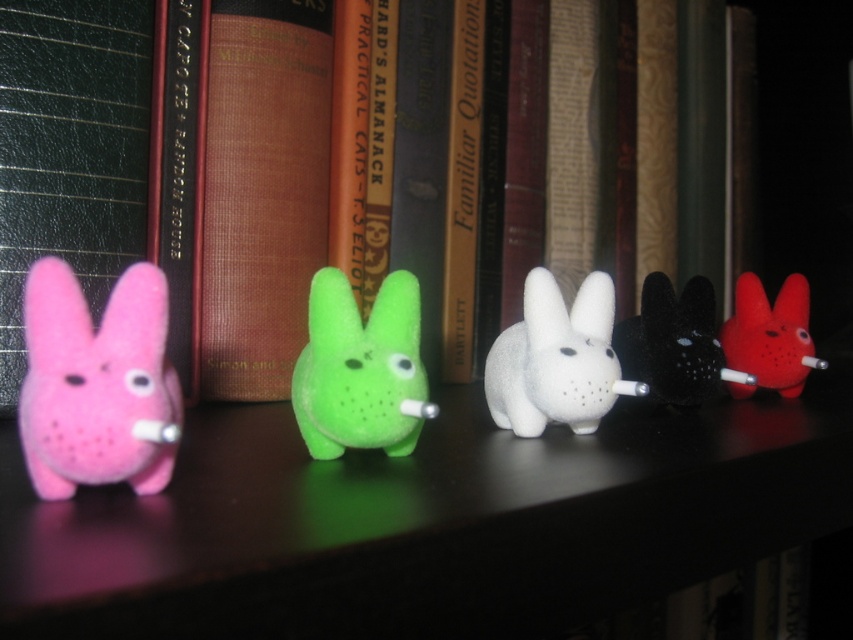
Question: Is matte pink plush at left to the right of green fuzzy bunny at center from the viewer's perspective?

Choices:
 (A) no
 (B) yes

Answer: (A)

Question: Is brown textured book at center to the left of black fuzzy bunny at center from the viewer's perspective?

Choices:
 (A) no
 (B) yes

Answer: (B)

Question: Estimate the real-world distances between objects in this image. Which object is farther from the black fuzzy bunny at center?

Choices:
 (A) matte pink plush at left
 (B) rubberized matte red rabbit at right
 (C) brown textured book at center

Answer: (A)

Question: Which object appears closest to the camera in this image?

Choices:
 (A) green fuzzy bunny at center
 (B) black fuzzy bunny at center

Answer: (A)

Question: Does pink felt bunny at left appear under white matte rabbit at center?

Choices:
 (A) yes
 (B) no

Answer: (B)

Question: Among these objects, which one is nearest to the camera?

Choices:
 (A) rubberized matte red rabbit at right
 (B) pink felt bunny at left
 (C) brown textured book at center

Answer: (B)